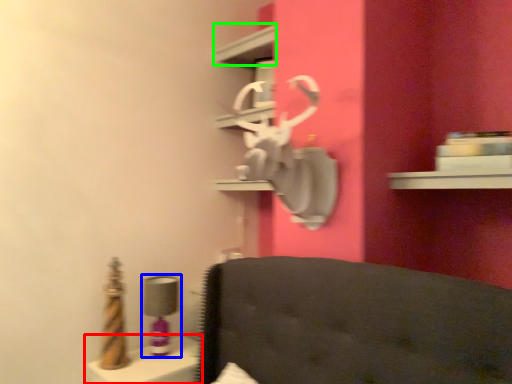
Question: Which is farther away from vanity (highlighted by a red box)? table lamp (highlighted by a blue box) or shelf (highlighted by a green box)?

Choices:
 (A) table lamp
 (B) shelf

Answer: (B)